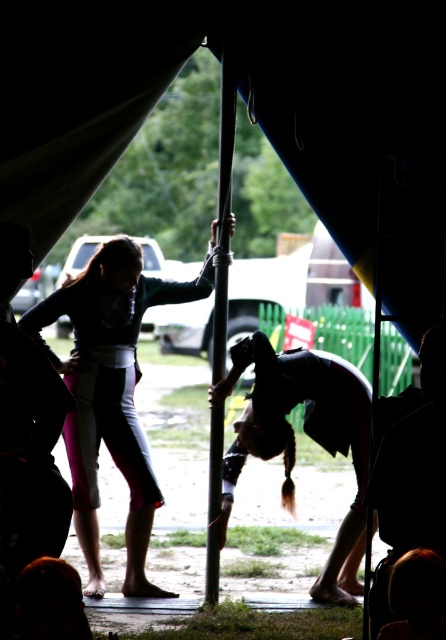
Question: Is dark brown hair at center closer to camera compared to metallic pole at center?

Choices:
 (A) yes
 (B) no

Answer: (B)

Question: Is light pink fabric pants at center positioned before metallic pole at center?

Choices:
 (A) no
 (B) yes

Answer: (A)

Question: Which object is farther from the camera taking this photo?

Choices:
 (A) light pink fabric pants at center
 (B) metallic pole at center
 (C) dark brown hair at center

Answer: (C)

Question: Which of the following is the farthest from the observer?

Choices:
 (A) (85, 460)
 (B) (221, 476)

Answer: (A)

Question: Is light pink fabric pants at center positioned before dark brown hair at center?

Choices:
 (A) no
 (B) yes

Answer: (B)

Question: Which point is closer to the camera?

Choices:
 (A) dark brown hair at center
 (B) light pink fabric pants at center
 (C) metallic pole at center

Answer: (C)